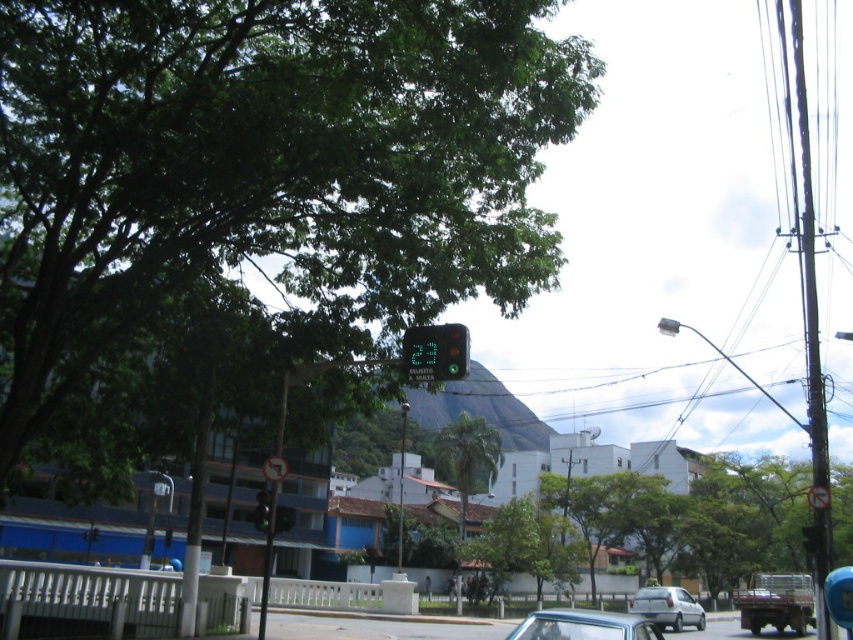
You are a GUI agent. You are given a task and a screenshot of the screen. Output one action in this format:
    pyautogui.click(x=<x>, y=<y>)
    Task: Click on the green matte traffic light at center
    
    Given the screenshot: What is the action you would take?
    [x=434, y=353]

Which is in front, point (421, 346) or point (676, 614)?

Point (421, 346)

Is point (463, 339) less distant than point (653, 620)?

Yes.

You are a GUI agent. You are given a task and a screenshot of the screen. Output one action in this format:
    pyautogui.click(x=<x>, y=<y>)
    Task: Click on the green matte traffic light at center
    
    Given the screenshot: What is the action you would take?
    pyautogui.click(x=434, y=353)

Who is higher up, green leafy tree at center or green glass traffic light at center?

Positioned higher is green glass traffic light at center.

Where is `green leafy tree at center`? Image resolution: width=853 pixels, height=640 pixels. green leafy tree at center is located at coordinates (695, 516).

Who is lower down, green leafy tree at upper left or white plastic sign at center?

Positioned lower is white plastic sign at center.

Does green leafy tree at upper left lie in front of white plastic sign at center?

Yes.

Is point (448, 262) positioned before point (271, 474)?

That is False.

Identify the location of green leafy tree at upper left. This screenshot has width=853, height=640. (253, 198).